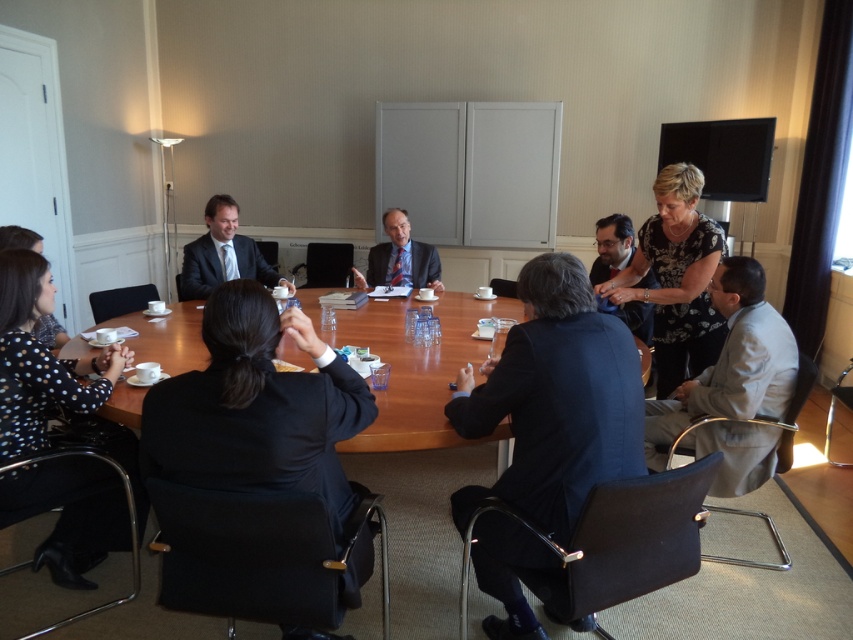
Question: Among these objects, which one is nearest to the camera?

Choices:
 (A) wooden table at center
 (B) light gray suit at lower right
 (C) matte black suit at left

Answer: (A)

Question: Considering the relative positions of matte black suit at left and matte blue suit at center in the image provided, where is matte black suit at left located with respect to matte blue suit at center?

Choices:
 (A) above
 (B) below

Answer: (B)

Question: Can you confirm if wooden table at center is positioned above light gray suit at lower right?

Choices:
 (A) yes
 (B) no

Answer: (A)

Question: Estimate the real-world distances between objects in this image. Which object is closer to the wooden table at center?

Choices:
 (A) light gray suit at lower right
 (B) matte blue suit at center

Answer: (B)

Question: Among these points, which one is farthest from the camera?

Choices:
 (A) (260, 269)
 (B) (368, 276)
 (C) (389, 324)

Answer: (B)

Question: Considering the relative positions of wooden table at center and light gray suit at lower right in the image provided, where is wooden table at center located with respect to light gray suit at lower right?

Choices:
 (A) right
 (B) left

Answer: (B)